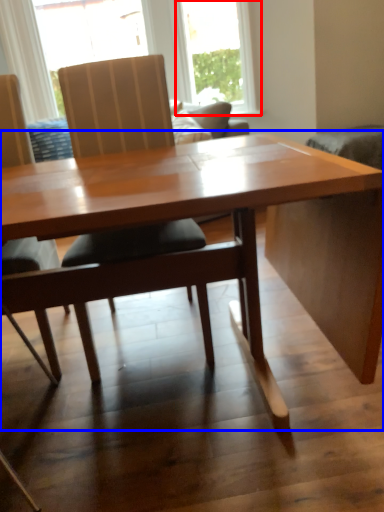
Question: Which of the following is the farthest to the observer, window (highlighted by a red box) or table (highlighted by a blue box)?

Choices:
 (A) window
 (B) table

Answer: (A)